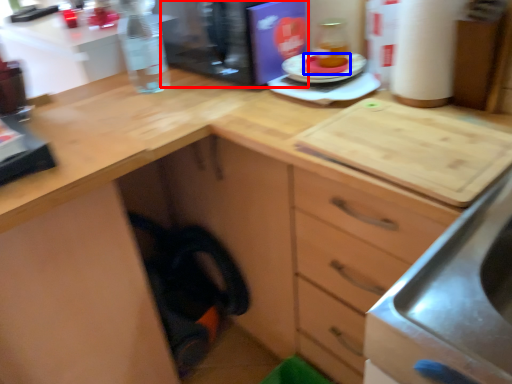
Question: Which point is closer to the camera, appliance (highlighted by a red box) or food (highlighted by a blue box)?

Choices:
 (A) appliance
 (B) food

Answer: (A)